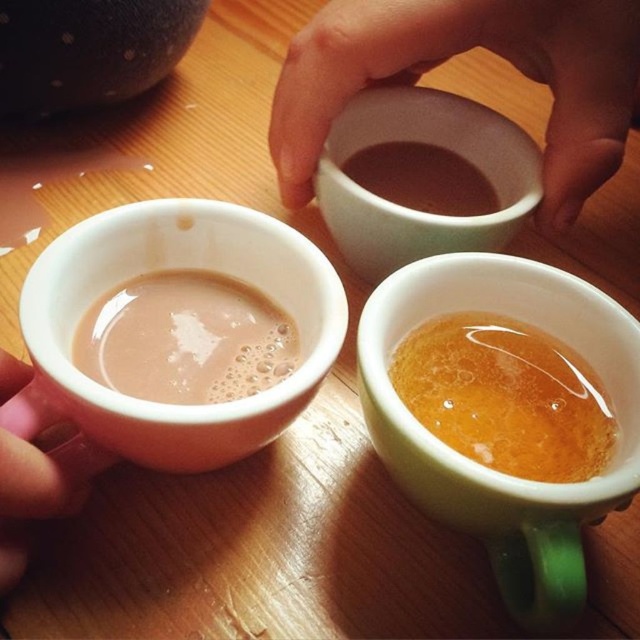
You are organizing a tea party and need to place a teapot exactly at the point marked by the coordinates point [460,52]. Which cup should you pour the tea into first based on its position?

The point [460,52] indicates the matte white cup at upper center, so you should pour the tea into the matte white cup at upper center first.